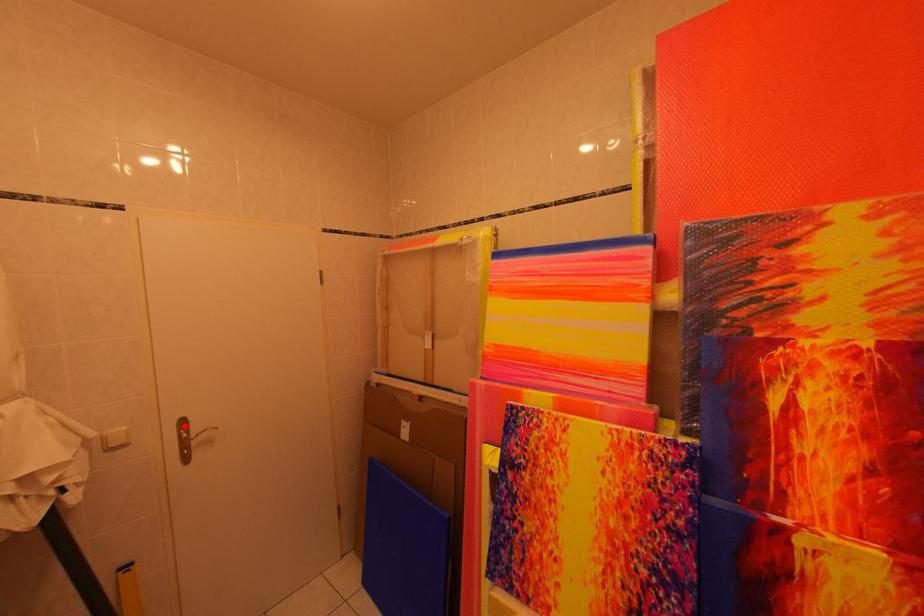
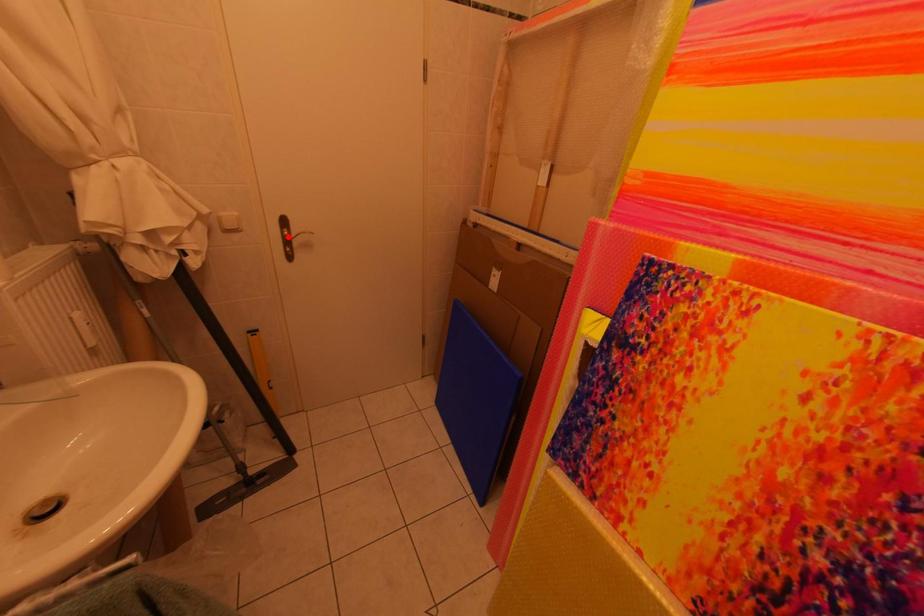
I am providing you with two images of the same scene from different viewpoints. A red point is marked on the first image and another point is marked on the second image. Is the marked point in image1 the same physical position as the marked point in image2?

No